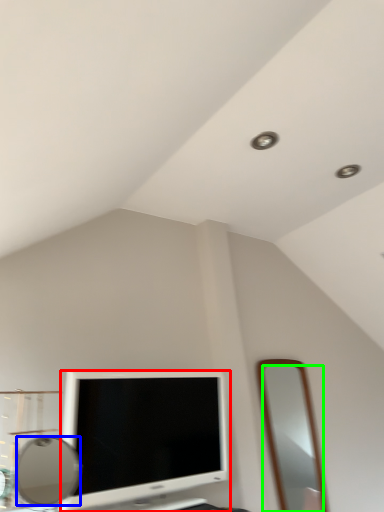
Question: Which object is positioned closest to television (highlighted by a red box)? Select from mirror (highlighted by a blue box) and mirror (highlighted by a green box).

Choices:
 (A) mirror
 (B) mirror

Answer: (A)